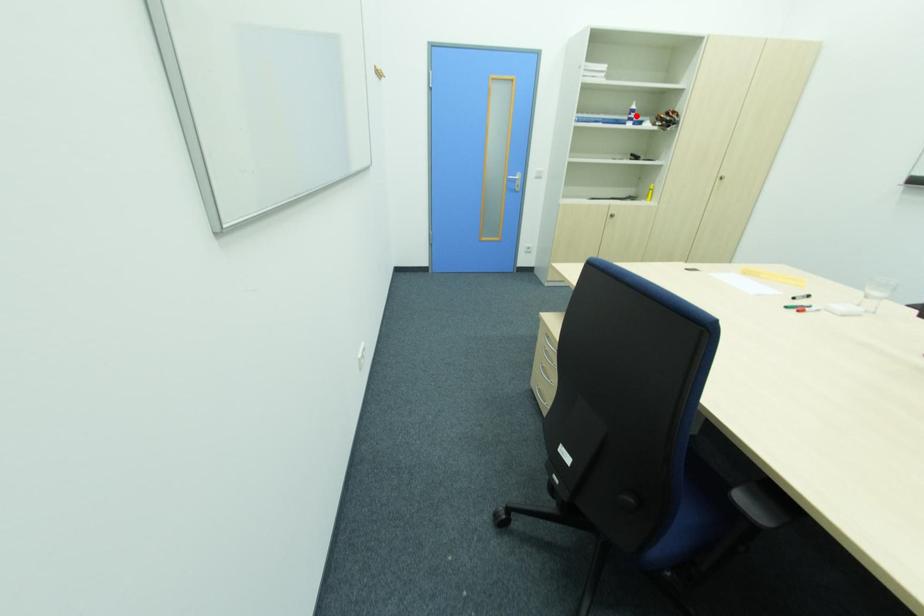
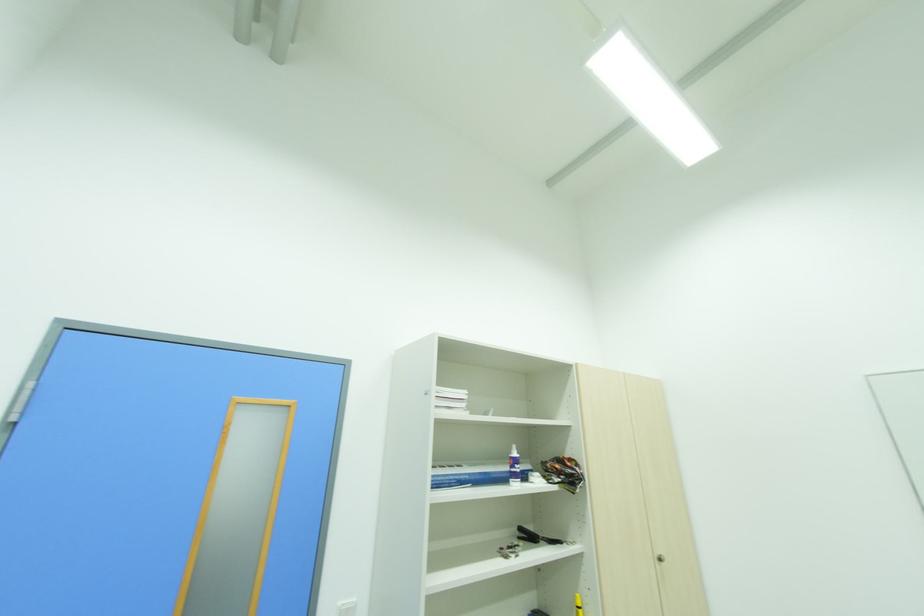
Question: I am providing you with two images of the same scene from different viewpoints. In image1, a red point is highlighted. Considering the same 3D point in image2, which of the following is correct?

Choices:
 (A) It is closer
 (B) It is farther

Answer: (B)